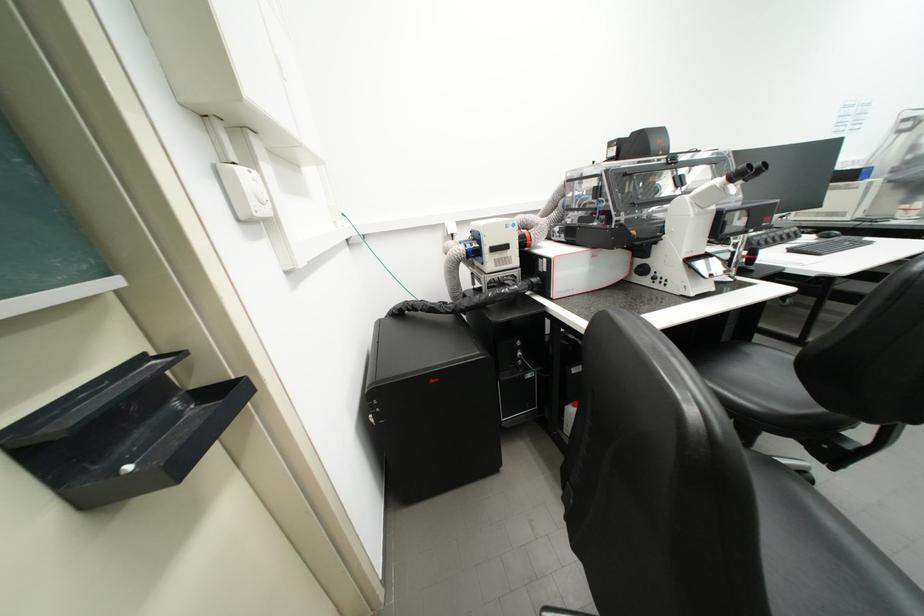
I want to click on white wall dial, so click(x=244, y=192).